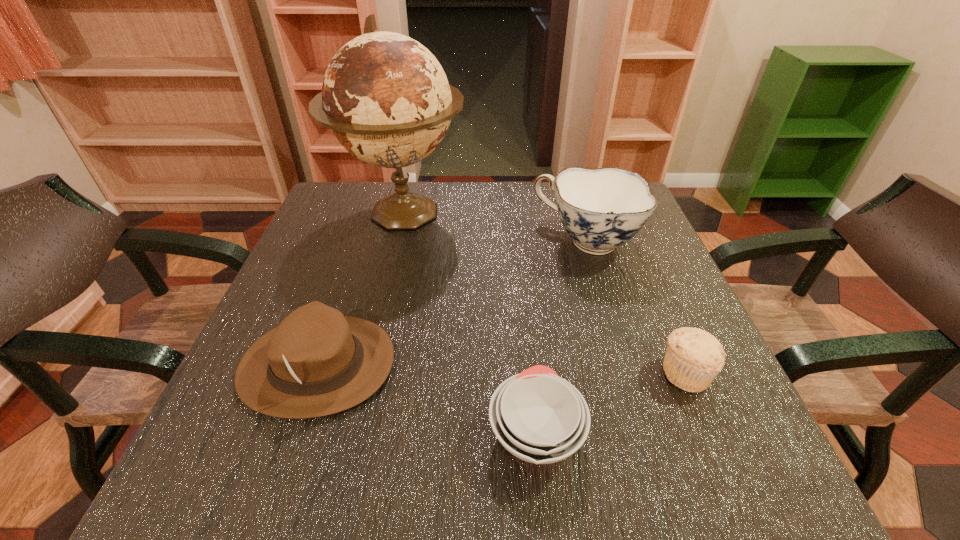
You are a GUI agent. You are given a task and a screenshot of the screen. Output one action in this format:
    pyautogui.click(x=<x>, y=<y>)
    Task: Click on the vacant space in between the shortest object and the chinaware
    The height and width of the screenshot is (540, 960).
    Given the screenshot: What is the action you would take?
    pyautogui.click(x=561, y=336)

Where is `blank region between the chinaware and the shortest object`? The height and width of the screenshot is (540, 960). blank region between the chinaware and the shortest object is located at coordinates (561, 336).

Locate an element on the screen. Image resolution: width=960 pixels, height=540 pixels. free space between the globe and the muffin is located at coordinates click(x=544, y=293).

The width and height of the screenshot is (960, 540). I want to click on vacant space that is in between the fourth tallest object and the tallest object, so pyautogui.click(x=544, y=293).

Where is `free point between the tallest object and the shortest object`? The image size is (960, 540). free point between the tallest object and the shortest object is located at coordinates (468, 323).

Where is `unoccupied area between the soup bowl and the muffin`? The width and height of the screenshot is (960, 540). unoccupied area between the soup bowl and the muffin is located at coordinates (611, 402).

Locate which object is the third closest to the third shortest object. Please provide its 2D coordinates. Your answer should be formatted as a tuple, i.e. [(x, y)], where the tuple contains the x and y coordinates of a point satisfying the conditions above.

[(601, 209)]

The width and height of the screenshot is (960, 540). I want to click on the fourth closest object to the chinaware, so click(317, 362).

In order to click on vacant space that satisfies the following two spatial constraints: 1. on the front side of the second tallest object; 2. on the feather side of the fedora in this screenshot , I will do pos(623,364).

You are a GUI agent. You are given a task and a screenshot of the screen. Output one action in this format:
    pyautogui.click(x=<x>, y=<y>)
    Task: Click on the vacant area in the image that satisfies the following two spatial constraints: 1. on the front of the second tallest object showing Asia; 2. on the left side of the tallest object
    
    Given the screenshot: What is the action you would take?
    pyautogui.click(x=396, y=241)